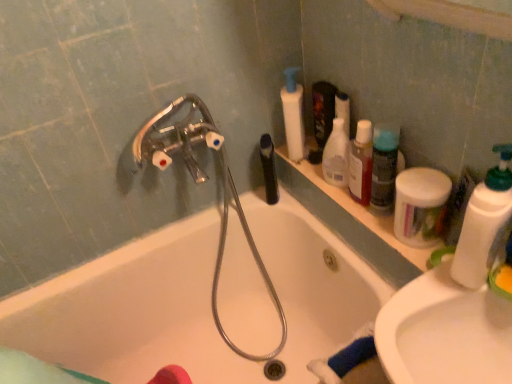
This screenshot has height=384, width=512. Find the location of `free region on the left part of black matte bottle at upper center, which ranks as the first mouthwash in back-to-front order`. free region on the left part of black matte bottle at upper center, which ranks as the first mouthwash in back-to-front order is located at coordinates (225, 208).